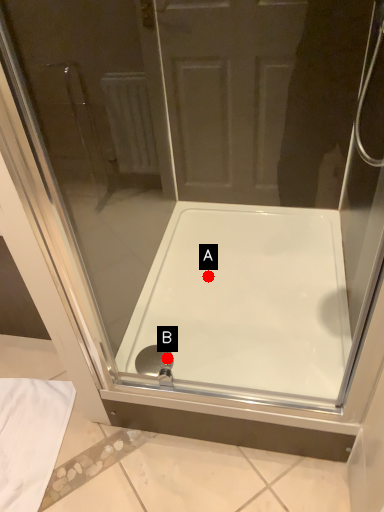
Question: Two points are circled on the image, labeled by A and B beside each circle. Which point is closer to the camera taking this photo?

Choices:
 (A) A is closer
 (B) B is closer

Answer: (B)